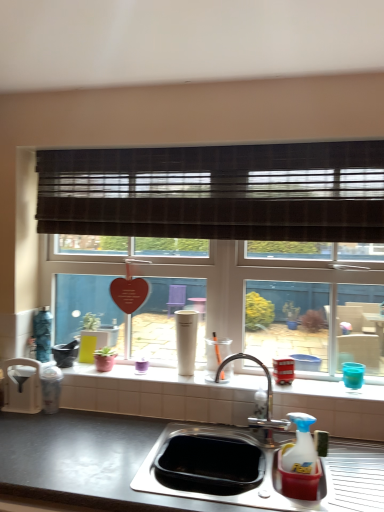
What do you see at coordinates (51, 388) in the screenshot? I see `metallic silver blender at lower left, which ranks as the 4th appliance in right-to-left order` at bounding box center [51, 388].

In order to click on white plastic trash can at left, acting as the 1th appliance starting from the left in this screenshot , I will do `click(22, 386)`.

Find the location of `white matte cup at center, the third appliance from the left`. white matte cup at center, the third appliance from the left is located at coordinates tap(186, 340).

How much space does metallic red bus at right, positioned as the fourth appliance in left-to-right order, occupy horizontally?

The width of metallic red bus at right, positioned as the fourth appliance in left-to-right order, is 3.02 inches.

This screenshot has height=512, width=384. I want to click on metallic red bus at right, positioned as the fourth appliance in left-to-right order, so click(283, 371).

The image size is (384, 512). I want to click on metallic silver blender at lower left, which ranks as the second appliance in left-to-right order, so click(51, 388).

Is white glossy window sill at center outside of brown textured blind at upper center?

white glossy window sill at center is positioned outside brown textured blind at upper center.

Does white glossy window sill at center have a smaller size compared to brown textured blind at upper center?

Yes, white glossy window sill at center is smaller than brown textured blind at upper center.

Could you tell me if white glossy window sill at center is turned towards brown textured blind at upper center?

No, white glossy window sill at center is not aimed at brown textured blind at upper center.

Based on the photo, does white plastic trash can at left, acting as the 1th appliance starting from the left, come in front of white matte cup at center, the third appliance from the left?

Yes, it is in front of white matte cup at center, the third appliance from the left.

Between white plastic trash can at left, arranged as the fifth appliance when viewed from the right, and white matte cup at center, the third appliance from the left, which one has smaller size?

white plastic trash can at left, arranged as the fifth appliance when viewed from the right, is smaller.

Is white plastic trash can at left, arranged as the fifth appliance when viewed from the right, completely or partially outside of white matte cup at center, the third appliance viewed from the right?

white plastic trash can at left, arranged as the fifth appliance when viewed from the right, is positioned outside white matte cup at center, the third appliance viewed from the right.

Is white plastic trash can at left, acting as the 1th appliance starting from the left, oriented away from white matte cup at center, the third appliance viewed from the right?

No, white plastic trash can at left, acting as the 1th appliance starting from the left,'s orientation is not away from white matte cup at center, the third appliance viewed from the right.

From the picture: From the image's perspective, does metallic red bus at right, the 2th appliance in the right-to-left sequence, appear higher than metallic silver blender at lower left, which ranks as the 4th appliance in right-to-left order?

Yes.

Is metallic red bus at right, positioned as the fourth appliance in left-to-right order, wider than metallic silver blender at lower left, which ranks as the second appliance in left-to-right order?

No.

Is metallic silver blender at lower left, which ranks as the 4th appliance in right-to-left order, at the back of metallic red bus at right, the 2th appliance in the right-to-left sequence?

No, metallic red bus at right, the 2th appliance in the right-to-left sequence, is not facing the opposite direction of metallic silver blender at lower left, which ranks as the 4th appliance in right-to-left order.

Which of these two, metallic red bus at right, the 2th appliance in the right-to-left sequence, or metallic silver blender at lower left, which ranks as the second appliance in left-to-right order, stands shorter?

metallic red bus at right, the 2th appliance in the right-to-left sequence, is shorter.

Where is `the 1st appliance in front when counting from the metallic silver blender at lower left, which ranks as the 4th appliance in right-to-left order`? The image size is (384, 512). the 1st appliance in front when counting from the metallic silver blender at lower left, which ranks as the 4th appliance in right-to-left order is located at coordinates (283, 371).

Is metallic silver blender at lower left, which ranks as the second appliance in left-to-right order, positioned before metallic red bus at right, positioned as the fourth appliance in left-to-right order?

No, metallic silver blender at lower left, which ranks as the second appliance in left-to-right order, is further to the viewer.

Can you confirm if metallic silver blender at lower left, which ranks as the 4th appliance in right-to-left order, is positioned to the right of metallic red bus at right, positioned as the fourth appliance in left-to-right order?

Incorrect, metallic silver blender at lower left, which ranks as the 4th appliance in right-to-left order, is not on the right side of metallic red bus at right, positioned as the fourth appliance in left-to-right order.

Based on their positions, is chrome metallic faucet at center located to the left or right of white plastic trash can at left, acting as the 1th appliance starting from the left?

Clearly, chrome metallic faucet at center is on the right of white plastic trash can at left, acting as the 1th appliance starting from the left, in the image.

Is point (284, 426) farther from viewer compared to point (9, 367)?

That is False.

Does chrome metallic faucet at center have a lesser height compared to white plastic trash can at left, acting as the 1th appliance starting from the left?

No.

Image resolution: width=384 pixels, height=512 pixels. What are the coordinates of `tap above the white plastic trash can at left, acting as the 1th appliance starting from the left (from a real-world perspective)` in the screenshot? It's located at (266, 401).

Which is in front, white matte cup at center, the third appliance from the left, or metallic silver blender at lower left, which ranks as the second appliance in left-to-right order?

metallic silver blender at lower left, which ranks as the second appliance in left-to-right order, is closer to the camera.

Does point (175, 318) come closer to viewer compared to point (49, 405)?

No, (175, 318) is further to viewer.

From the picture: Is white matte cup at center, the third appliance from the left, taller or shorter than metallic silver blender at lower left, which ranks as the 4th appliance in right-to-left order?

Considering their sizes, white matte cup at center, the third appliance from the left, has more height than metallic silver blender at lower left, which ranks as the 4th appliance in right-to-left order.

Considering the relative sizes of metallic silver blender at lower left, which ranks as the second appliance in left-to-right order, and white plastic trash can at left, acting as the 1th appliance starting from the left, in the image provided, is metallic silver blender at lower left, which ranks as the second appliance in left-to-right order, taller than white plastic trash can at left, acting as the 1th appliance starting from the left,?

No.

In the scene shown: Can you tell me how much metallic silver blender at lower left, which ranks as the second appliance in left-to-right order, and white plastic trash can at left, arranged as the fifth appliance when viewed from the right, differ in facing direction?

0.00437 degrees separate the facing orientations of metallic silver blender at lower left, which ranks as the second appliance in left-to-right order, and white plastic trash can at left, arranged as the fifth appliance when viewed from the right.

Considering the sizes of objects metallic silver blender at lower left, which ranks as the second appliance in left-to-right order, and white plastic trash can at left, arranged as the fifth appliance when viewed from the right, in the image provided, who is smaller, metallic silver blender at lower left, which ranks as the second appliance in left-to-right order, or white plastic trash can at left, arranged as the fifth appliance when viewed from the right,?

metallic silver blender at lower left, which ranks as the second appliance in left-to-right order.

In the image, there is a white glossy window sill at center. At what (x,y) coordinates should I click in order to perform the action: click on window blind above it (from the image's perspective). Please return your answer as a coordinate pair (x, y). This screenshot has height=512, width=384. Looking at the image, I should click on (217, 192).

Find the location of `appliance behind the white plastic trash can at left, arranged as the fifth appliance when viewed from the right`. appliance behind the white plastic trash can at left, arranged as the fifth appliance when viewed from the right is located at coordinates (186, 340).

Which object lies nearer to the anchor point white plastic trash can at left, arranged as the fifth appliance when viewed from the right, white glossy window sill at center or stainless steel sink at lower center?

stainless steel sink at lower center lies closer to white plastic trash can at left, arranged as the fifth appliance when viewed from the right, than the other object.

Based on their spatial positions, is blue plastic cup at right, which ranks as the 1th appliance in right-to-left order, or chrome metallic faucet at center closer to brown textured blind at upper center?

chrome metallic faucet at center is positioned closer to the anchor brown textured blind at upper center.

Estimate the real-world distances between objects in this image. Which object is further from metallic silver blender at lower left, which ranks as the second appliance in left-to-right order, stainless steel sink at lower center or white glossy window sill at center?

white glossy window sill at center is positioned further to the anchor metallic silver blender at lower left, which ranks as the second appliance in left-to-right order.

When comparing their distances from metallic silver blender at lower left, which ranks as the second appliance in left-to-right order, does brown textured blind at upper center or chrome metallic faucet at center seem further?

brown textured blind at upper center is positioned further to the anchor metallic silver blender at lower left, which ranks as the second appliance in left-to-right order.

Based on the photo, which object lies nearer to the anchor point stainless steel sink at lower center, white glossy window sill at center or brown textured blind at upper center?

white glossy window sill at center is positioned closer to the anchor stainless steel sink at lower center.

From the image, which object appears to be farther from white glossy window sill at center, white matte cup at center, the third appliance viewed from the right, or stainless steel sink at lower center?

stainless steel sink at lower center.

When comparing their distances from metallic silver blender at lower left, which ranks as the 4th appliance in right-to-left order, does white matte cup at center, the third appliance from the left, or white plastic trash can at left, acting as the 1th appliance starting from the left, seem further?

The object further to metallic silver blender at lower left, which ranks as the 4th appliance in right-to-left order, is white matte cup at center, the third appliance from the left.

Which object lies nearer to the anchor point blue plastic cup at right, positioned as the fifth appliance in left-to-right order, white plastic trash can at left, acting as the 1th appliance starting from the left, or white matte cup at center, the third appliance from the left?

white matte cup at center, the third appliance from the left, is positioned closer to the anchor blue plastic cup at right, positioned as the fifth appliance in left-to-right order.

Locate an element on the screen. This screenshot has height=512, width=384. tap between brown textured blind at upper center and stainless steel sink at lower center from top to bottom is located at coordinates (266, 401).

Locate an element on the screen. This screenshot has width=384, height=512. window sill located between chrome metallic faucet at center and white matte cup at center, the third appliance from the left, in the depth direction is located at coordinates [x=150, y=385].

Where is `window sill between brown textured blind at upper center and metallic silver blender at lower left, which ranks as the second appliance in left-to-right order, in the up-down direction`? The width and height of the screenshot is (384, 512). window sill between brown textured blind at upper center and metallic silver blender at lower left, which ranks as the second appliance in left-to-right order, in the up-down direction is located at coordinates (150, 385).

The width and height of the screenshot is (384, 512). What are the coordinates of `countertop between metallic silver blender at lower left, which ranks as the 4th appliance in right-to-left order, and blue plastic cup at right, which ranks as the 1th appliance in right-to-left order, in the horizontal direction` in the screenshot? It's located at (83, 461).